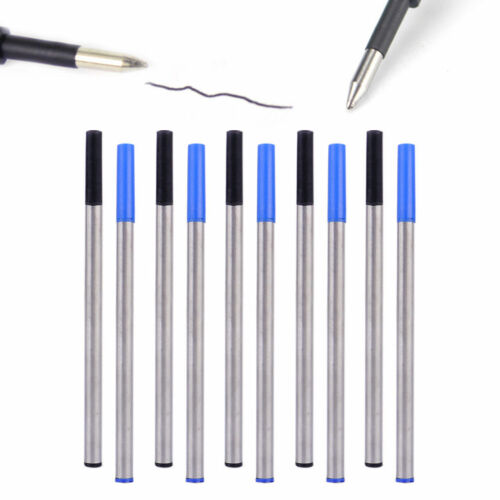
Identify the location of pens with lids. Image resolution: width=500 pixels, height=500 pixels. (92, 175), (124, 179), (161, 170), (193, 186), (235, 183), (265, 197), (307, 186), (337, 192), (373, 177), (410, 192).